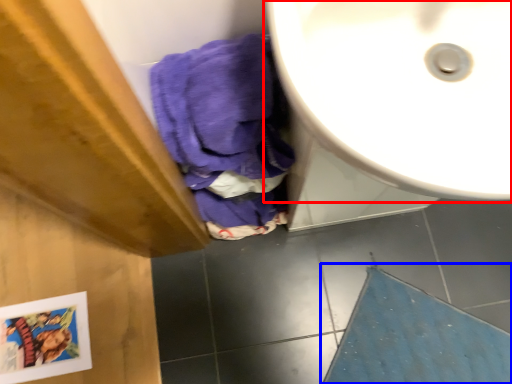
Question: Which of the following is the closest to the observer, sink (highlighted by a red box) or bath mat (highlighted by a blue box)?

Choices:
 (A) sink
 (B) bath mat

Answer: (A)